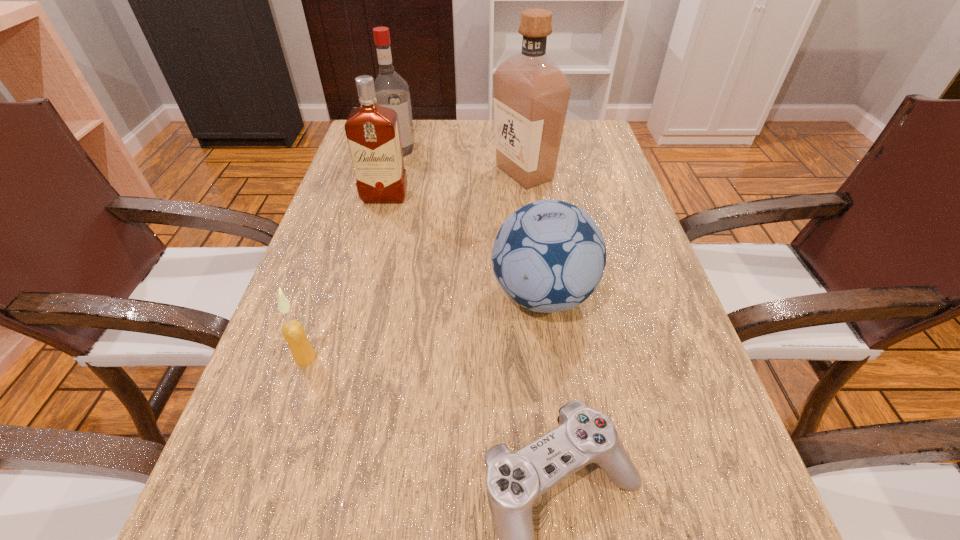
Locate an element on the screen. Image resolution: width=960 pixels, height=540 pixels. the tallest object is located at coordinates (531, 93).

You are a GUI agent. You are given a task and a screenshot of the screen. Output one action in this format:
    pyautogui.click(x=<x>, y=<y>)
    Task: Click on the tallest liquor
    The height and width of the screenshot is (540, 960).
    Given the screenshot: What is the action you would take?
    pyautogui.click(x=531, y=93)

The height and width of the screenshot is (540, 960). What are the coordinates of `soccer ball` in the screenshot? It's located at (549, 256).

The image size is (960, 540). I want to click on the third shortest object, so click(x=549, y=256).

Locate an element on the screen. Image resolution: width=960 pixels, height=540 pixels. candle is located at coordinates (293, 331).

Where is `the second nearest object`? the second nearest object is located at coordinates (293, 331).

At what (x,y) coordinates should I click in order to perform the action: click on vacant space located on the front-facing side of the rightmost liquor. Please return your answer as a coordinate pair (x, y). The width and height of the screenshot is (960, 540). Looking at the image, I should click on (450, 173).

The image size is (960, 540). Find the location of `vacant space located 0.210m on the front-facing side of the rightmost liquor`. vacant space located 0.210m on the front-facing side of the rightmost liquor is located at coordinates (413, 173).

Image resolution: width=960 pixels, height=540 pixels. Identify the location of vacant space located 0.270m on the front-facing side of the rightmost liquor. (390, 173).

At what (x,y) coordinates should I click in order to perform the action: click on vacant area situated 0.330m on the side with brand of the third shortest object. Please return your answer as a coordinate pair (x, y). Looking at the image, I should click on pos(322,295).